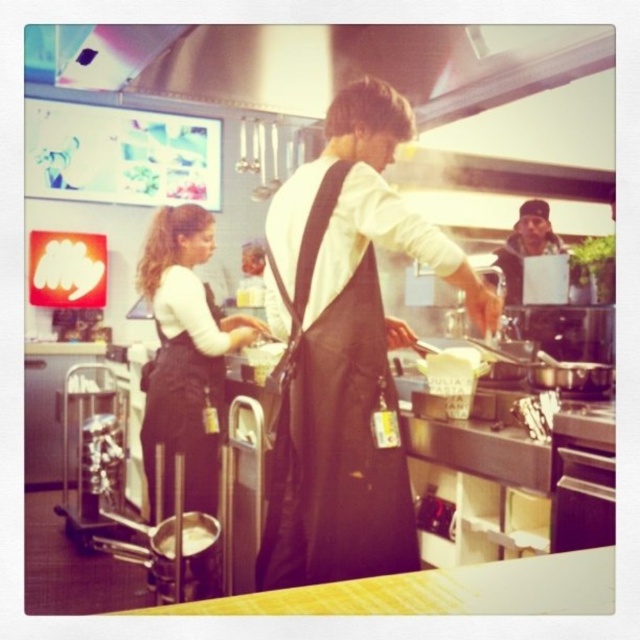
Does black fabric apron at center have a larger size compared to yellow matte bowl at center?

Correct, black fabric apron at center is larger in size than yellow matte bowl at center.

Between black fabric apron at center and yellow matte bowl at center, which one appears on the right side from the viewer's perspective?

black fabric apron at center is more to the right.

Find the location of a particular element. The image size is (640, 640). black fabric apron at center is located at coordinates (332, 429).

Is black fabric apron at center positioned behind dark gray knit cap at upper right?

No, black fabric apron at center is in front of dark gray knit cap at upper right.

The height and width of the screenshot is (640, 640). What do you see at coordinates (332, 429) in the screenshot?
I see `black fabric apron at center` at bounding box center [332, 429].

At what (x,y) coordinates should I click in order to perform the action: click on black fabric apron at center. Please return your answer as a coordinate pair (x, y). Image resolution: width=640 pixels, height=640 pixels. Looking at the image, I should click on (332, 429).

Who is positioned more to the left, dark gray apron at center-left or yellow matte bowl at center?

Positioned to the left is dark gray apron at center-left.

Describe the element at coordinates (184, 355) in the screenshot. I see `dark gray apron at center-left` at that location.

Image resolution: width=640 pixels, height=640 pixels. Find the location of `dark gray apron at center-left`. dark gray apron at center-left is located at coordinates (184, 355).

Locate an element on the screen. This screenshot has height=640, width=640. dark gray apron at center-left is located at coordinates (184, 355).